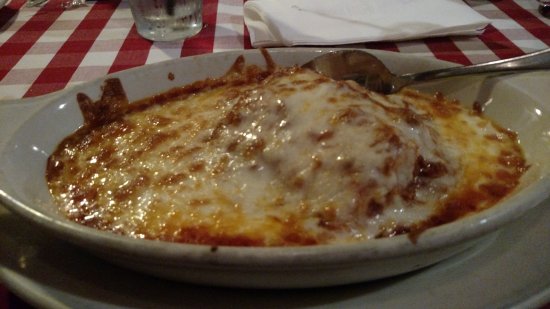
What are the coordinates of `drinking glass` in the screenshot? It's located at (170, 15).